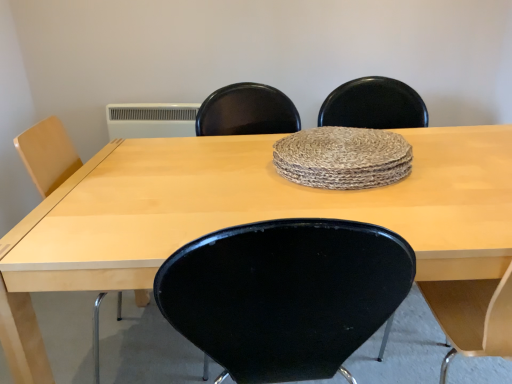
Question: Is natural fiber placemat at center inside or outside of light wood table at center?

Choices:
 (A) outside
 (B) inside

Answer: (A)

Question: Looking at their shapes, would you say natural fiber placemat at center is wider or thinner than light wood table at center?

Choices:
 (A) wide
 (B) thin

Answer: (B)

Question: In the image, is natural fiber placemat at center positioned in front of or behind light wood table at center?

Choices:
 (A) behind
 (B) front

Answer: (A)

Question: Is light wood table at center taller or shorter than natural fiber placemat at center?

Choices:
 (A) short
 (B) tall

Answer: (B)

Question: Which is correct: light wood table at center is inside natural fiber placemat at center, or outside of it?

Choices:
 (A) outside
 (B) inside

Answer: (A)

Question: From a real-world perspective, is light wood table at center above or below natural fiber placemat at center?

Choices:
 (A) above
 (B) below

Answer: (B)

Question: Considering the relative positions of light wood table at center and natural fiber placemat at center in the image provided, is light wood table at center to the left or to the right of natural fiber placemat at center?

Choices:
 (A) right
 (B) left

Answer: (B)